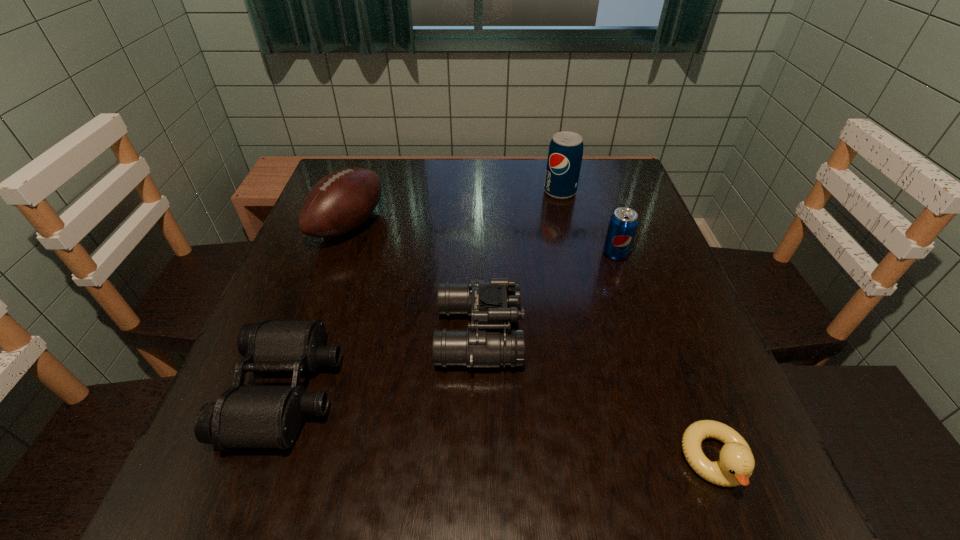
At what (x,y) coordinates should I click in order to perform the action: click on free point located 0.120m on the front of the football (American). Please return your answer as a coordinate pair (x, y). This screenshot has height=540, width=960. Looking at the image, I should click on (324, 294).

This screenshot has height=540, width=960. I want to click on vacant region located 0.370m on the front of the right pop soda, so click(669, 415).

Locate an element on the screen. The image size is (960, 540). free space located 0.300m through the lenses of the taller binoculars is located at coordinates (679, 334).

Locate an element on the screen. Image resolution: width=960 pixels, height=540 pixels. free space located 0.270m through the eyepieces of the shorter binoculars is located at coordinates (495, 389).

Identify the location of pop positioned at the far edge. (565, 153).

Locate an element on the screen. Image resolution: width=960 pixels, height=540 pixels. football (American) that is at the far edge is located at coordinates (340, 202).

Image resolution: width=960 pixels, height=540 pixels. Identify the location of binoculars that is at the near edge. (244, 416).

Locate an element on the screen. The width and height of the screenshot is (960, 540). duckling present at the near edge is located at coordinates (736, 464).

Locate an element on the screen. This screenshot has width=960, height=540. football (American) located in the left edge section of the desktop is located at coordinates (340, 202).

At what (x,y) coordinates should I click in order to perform the action: click on binoculars that is at the left edge. Please return your answer as a coordinate pair (x, y). Looking at the image, I should click on (244, 416).